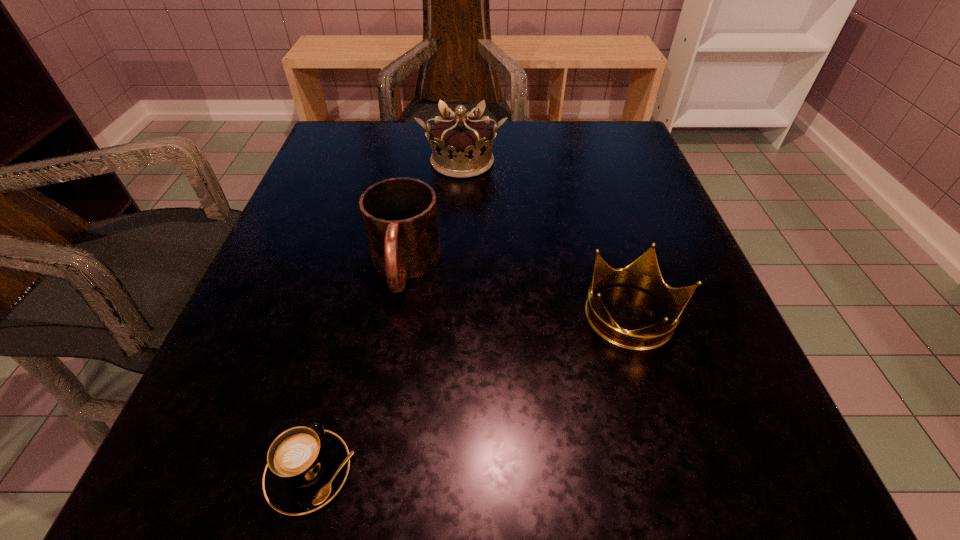
In the image, there is a desktop. Where is `vacant space at the far right corner`? The height and width of the screenshot is (540, 960). vacant space at the far right corner is located at coordinates (629, 131).

This screenshot has width=960, height=540. I want to click on free region at the near right corner of the desktop, so click(x=657, y=465).

Find the location of `free area in between the mug and the cappuccino`. free area in between the mug and the cappuccino is located at coordinates (357, 369).

The height and width of the screenshot is (540, 960). In order to click on vacant point located between the cappuccino and the rightmost object in this screenshot , I will do `click(471, 394)`.

At what (x,y) coordinates should I click in order to perform the action: click on blank region between the farther crown and the shorter crown. Please return your answer as a coordinate pair (x, y). The image size is (960, 540). Looking at the image, I should click on (547, 239).

Locate an element on the screen. The image size is (960, 540). empty space between the taller crown and the shortest object is located at coordinates (386, 317).

At what (x,y) coordinates should I click in order to perform the action: click on free spot between the right crown and the nearest object. Please return your answer as a coordinate pair (x, y). Looking at the image, I should click on (471, 394).

Find the location of a particular element. This screenshot has height=540, width=960. vacant area that lies between the cappuccino and the taller crown is located at coordinates (386, 317).

You are a GUI agent. You are given a task and a screenshot of the screen. Output one action in this format:
    pyautogui.click(x=<x>, y=<y>)
    Task: Click on the vacant space in between the shortest object and the rightmost object
    The width and height of the screenshot is (960, 540).
    Given the screenshot: What is the action you would take?
    pyautogui.click(x=471, y=394)

The image size is (960, 540). What are the coordinates of `free space that is in between the nearer crown and the mug` in the screenshot? It's located at (518, 292).